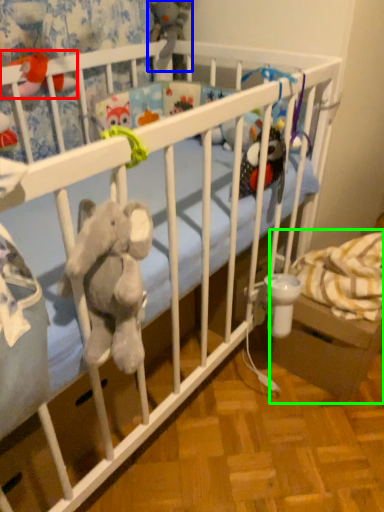
Question: Estimate the real-world distances between objects in this image. Which object is farther from toy (highlighted by a red box), toy (highlighted by a blue box) or baby carriage (highlighted by a green box)?

Choices:
 (A) toy
 (B) baby carriage

Answer: (B)